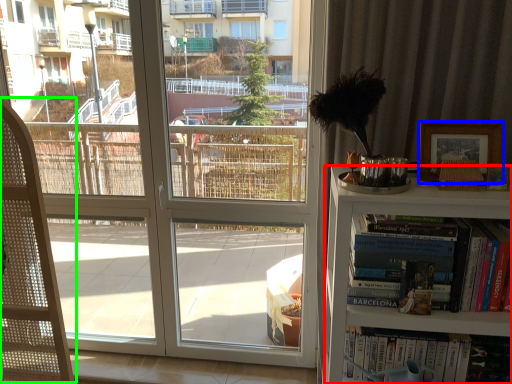
Question: Which is farther away from bookcase (highlighted by a red box)? picture frame (highlighted by a blue box) or folding chair (highlighted by a green box)?

Choices:
 (A) picture frame
 (B) folding chair

Answer: (B)